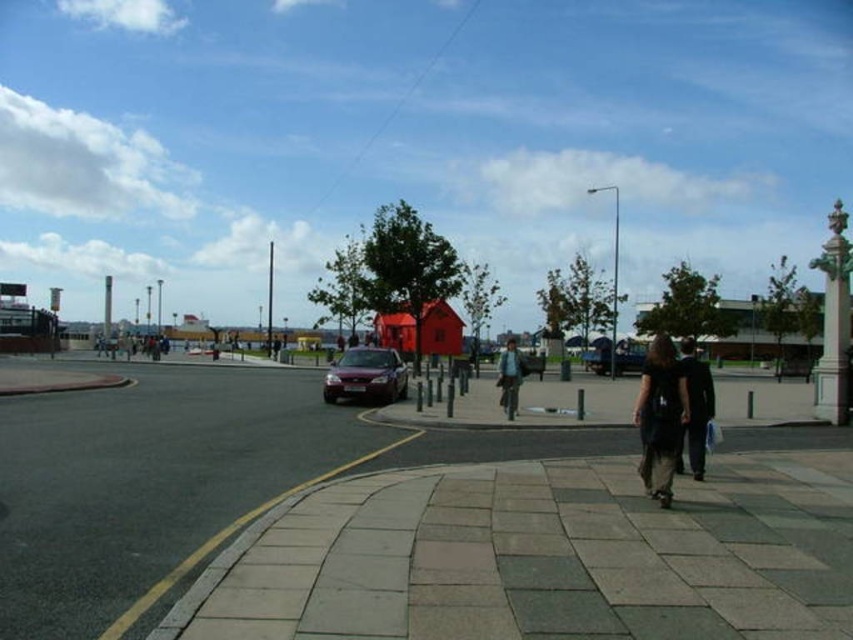
Which of these two, maroon metallic car at center or light brown leather jacket at center, stands shorter?

maroon metallic car at center is shorter.

Does point (384, 390) come behind point (517, 356)?

Yes, point (384, 390) is behind point (517, 356).

Where is `maroon metallic car at center`? maroon metallic car at center is located at coordinates (366, 376).

Find the location of `paved stone sidewalk at center`. paved stone sidewalk at center is located at coordinates (403, 524).

Does paved stone sidewalk at center appear over dark blue jacket at center?

Incorrect, paved stone sidewalk at center is not positioned above dark blue jacket at center.

Image resolution: width=853 pixels, height=640 pixels. In order to click on paved stone sidewalk at center in this screenshot , I will do `click(403, 524)`.

In the scene shown: Between dark gray suit at lower right and dark blue jacket at center, which one appears on the right side from the viewer's perspective?

Positioned to the right is dark gray suit at lower right.

Who is more distant from viewer, (x=688, y=410) or (x=151, y=348)?

Point (x=151, y=348)

Is point (698, 420) closer to camera compared to point (161, 349)?

Yes.

Identify the location of dark gray suit at lower right. [695, 406].